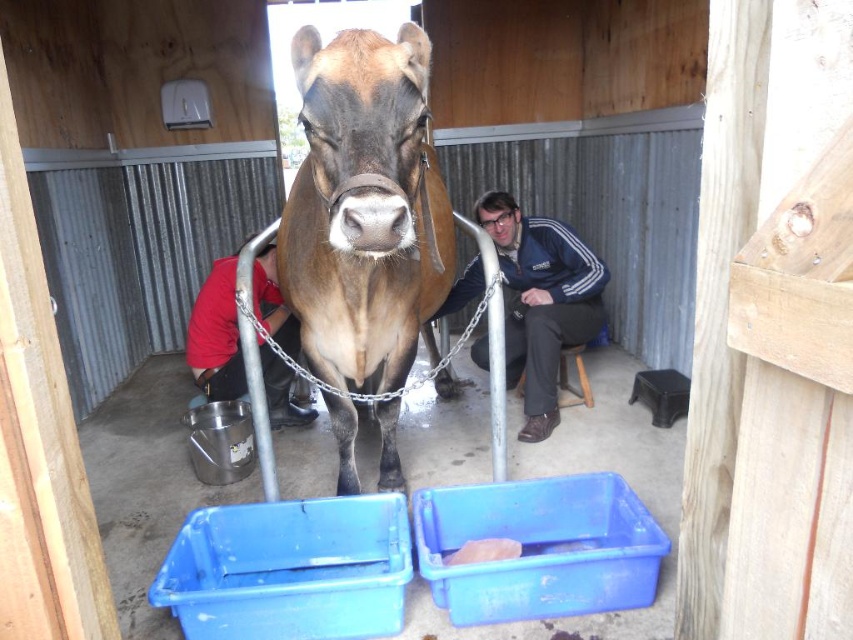
Is brown glossy cow at center further to camera compared to blue fabric jacket at center?

No.

Which is more to the right, brown glossy cow at center or blue fabric jacket at center?

blue fabric jacket at center is more to the right.

Between point (285, 296) and point (532, 252), which one is positioned in front?

Point (285, 296) is in front.

Identify the location of brown glossy cow at center. (364, 209).

Is brown glossy cow at center smaller than red shirt at lower left?

No, brown glossy cow at center is not smaller than red shirt at lower left.

I want to click on brown glossy cow at center, so click(x=364, y=209).

Between point (548, 387) and point (289, 342), which one is positioned behind?

The point (289, 342) is more distant.

Between blue fabric jacket at center and red shirt at lower left, which one has more height?

Standing taller between the two is blue fabric jacket at center.

What do you see at coordinates (541, 301) in the screenshot? This screenshot has width=853, height=640. I see `blue fabric jacket at center` at bounding box center [541, 301].

Image resolution: width=853 pixels, height=640 pixels. I want to click on blue fabric jacket at center, so click(541, 301).